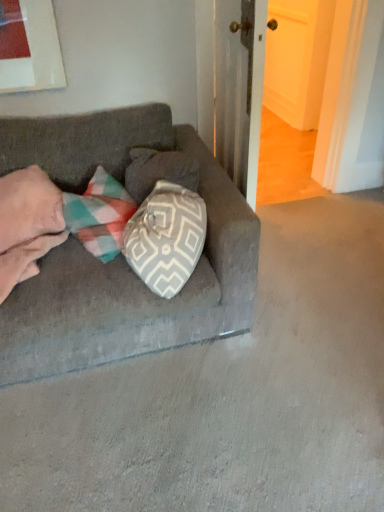
Question: Is pink soft blanket at left further to the viewer compared to velvet gray couch at center?

Choices:
 (A) no
 (B) yes

Answer: (B)

Question: Can you confirm if pink soft blanket at left is smaller than velvet gray couch at center?

Choices:
 (A) no
 (B) yes

Answer: (B)

Question: From a real-world perspective, is pink soft blanket at left physically below velvet gray couch at center?

Choices:
 (A) no
 (B) yes

Answer: (A)

Question: Can you confirm if pink soft blanket at left is wider than velvet gray couch at center?

Choices:
 (A) no
 (B) yes

Answer: (A)

Question: From the image's perspective, does pink soft blanket at left appear lower than velvet gray couch at center?

Choices:
 (A) yes
 (B) no

Answer: (B)

Question: Is pink soft blanket at left directly adjacent to velvet gray couch at center?

Choices:
 (A) no
 (B) yes

Answer: (A)

Question: Is velvet gray couch at center in contact with pink soft blanket at left?

Choices:
 (A) no
 (B) yes

Answer: (A)

Question: Can you confirm if velvet gray couch at center is smaller than pink soft blanket at left?

Choices:
 (A) yes
 (B) no

Answer: (B)

Question: Is velvet gray couch at center taller than pink soft blanket at left?

Choices:
 (A) no
 (B) yes

Answer: (B)

Question: From the image's perspective, is velvet gray couch at center beneath pink soft blanket at left?

Choices:
 (A) yes
 (B) no

Answer: (A)

Question: Can you confirm if velvet gray couch at center is shorter than pink soft blanket at left?

Choices:
 (A) yes
 (B) no

Answer: (B)

Question: Does velvet gray couch at center contain pink soft blanket at left?

Choices:
 (A) no
 (B) yes

Answer: (B)

Question: Considering the positions of point pyautogui.click(x=9, y=365) and point pyautogui.click(x=19, y=231), is point pyautogui.click(x=9, y=365) closer or farther from the camera than point pyautogui.click(x=19, y=231)?

Choices:
 (A) closer
 (B) farther

Answer: (A)